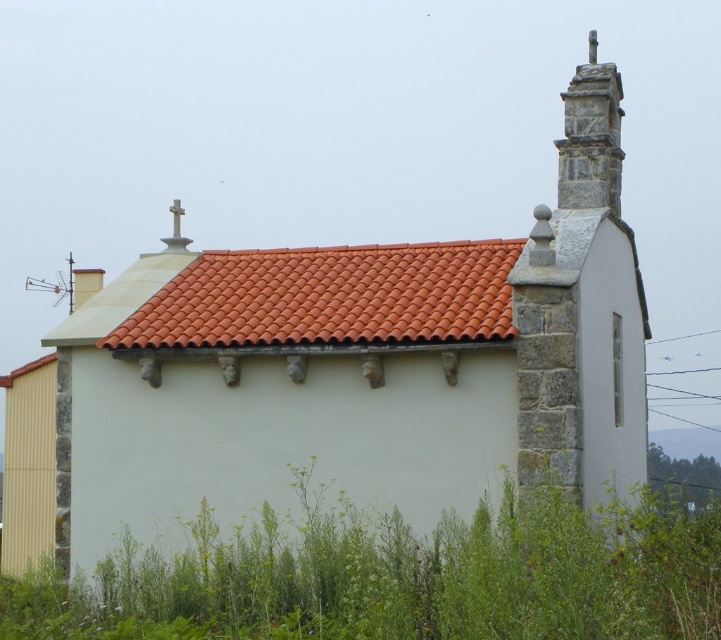
You are standing in front of the building and want to place a new decorative element between the terracotta tiles at center and the stone cross at upper right. Based on their positions, which object is closer to you, and where should you place the new element?

The terracotta tiles at center is in front of the stone cross at upper right, so the terracotta tiles at center is closer to you. You should place the new decorative element between them, closer to the terracotta tiles at center.

You are a gardener who needs to place a 15 feet long hose between the green grass at lower left and the terracotta tiles at center. Can you fit the hose between them without bending it?

The distance between the green grass at lower left and the terracotta tiles at center is 17.12 feet, which is longer than the 15 feet hose. Therefore, the hose will not reach the entire distance, so it cannot be placed straight between them without bending.

You are standing in front of the building and want to place a new flowerpot between the green grass at lower left and the stone cross at upper right. Based on their positions, which side of the flowerpot should face the building?

The green grass at lower left is to the left of the stone cross at upper right, so the flowerpot should be placed between them with its right side facing the building.